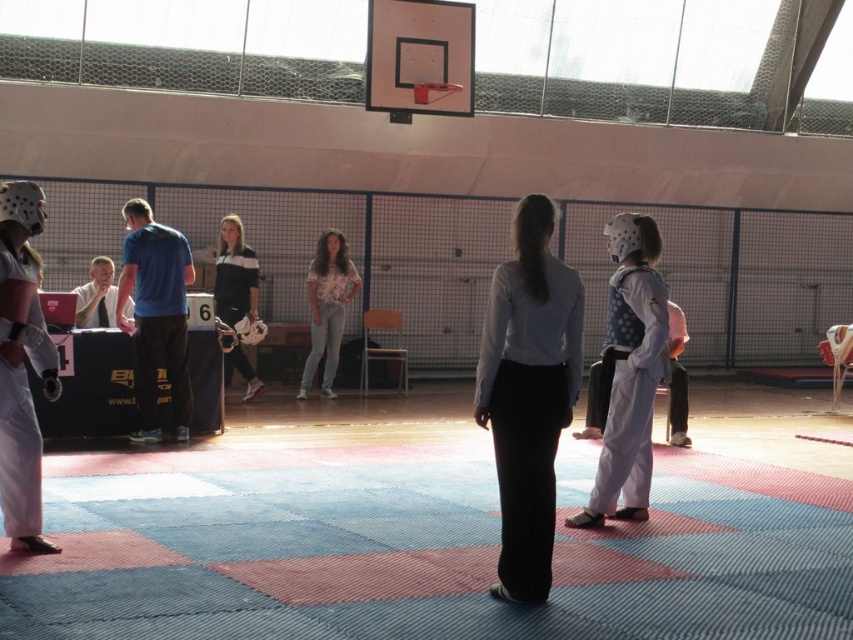
You are a photographer standing at the back of the gymnasium. You want to take a photo of both the white smooth shirt at center and the floral shirt at center in the same frame. Given that your camera has a maximum focus range of 8 meters, will you be able to capture both subjects clearly in one shot?

The distance between the white smooth shirt at center and the floral shirt at center is 8.51 meters, which exceeds the camera maximum focus range of 8 meters. Therefore, you will not be able to capture both subjects clearly in one shot.

Where is the white smooth shirt at center located in the image?

The white smooth shirt at center is located at point coordinates of approximately 0.616 on the x axis and 0.620 on the y axis.